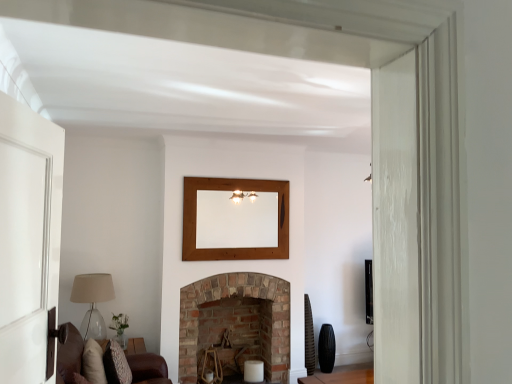
Question: Is translucent glass lampshade at left outside of brown leather couch at lower left?

Choices:
 (A) no
 (B) yes

Answer: (B)

Question: Can you confirm if translucent glass lampshade at left is positioned to the right of brown leather couch at lower left?

Choices:
 (A) no
 (B) yes

Answer: (A)

Question: From a real-world perspective, is translucent glass lampshade at left located higher than brown leather couch at lower left?

Choices:
 (A) yes
 (B) no

Answer: (A)

Question: Is translucent glass lampshade at left to the left of brown leather couch at lower left from the viewer's perspective?

Choices:
 (A) no
 (B) yes

Answer: (B)

Question: Is translucent glass lampshade at left wider than brown leather couch at lower left?

Choices:
 (A) no
 (B) yes

Answer: (A)

Question: In terms of width, does wooden mirror at upper center look wider or thinner when compared to brown leather couch at lower left?

Choices:
 (A) thin
 (B) wide

Answer: (A)

Question: From a real-world perspective, is wooden mirror at upper center positioned above or below brown leather couch at lower left?

Choices:
 (A) above
 (B) below

Answer: (A)

Question: Is point [x=251, y=215] closer or farther from the camera than point [x=134, y=375]?

Choices:
 (A) closer
 (B) farther

Answer: (B)

Question: Would you say wooden mirror at upper center is inside or outside brown leather couch at lower left?

Choices:
 (A) outside
 (B) inside

Answer: (A)

Question: Considering the positions of translucent glass lampshade at left and wooden mirror at upper center in the image, is translucent glass lampshade at left bigger or smaller than wooden mirror at upper center?

Choices:
 (A) small
 (B) big

Answer: (B)

Question: Looking at their shapes, would you say translucent glass lampshade at left is wider or thinner than wooden mirror at upper center?

Choices:
 (A) thin
 (B) wide

Answer: (B)

Question: Considering their positions, is translucent glass lampshade at left located in front of or behind wooden mirror at upper center?

Choices:
 (A) front
 (B) behind

Answer: (A)

Question: Is point (99, 291) closer or farther from the camera than point (253, 210)?

Choices:
 (A) farther
 (B) closer

Answer: (B)

Question: Considering the positions of brown leather couch at lower left and wooden mirror at upper center in the image, is brown leather couch at lower left taller or shorter than wooden mirror at upper center?

Choices:
 (A) tall
 (B) short

Answer: (B)

Question: Considering the positions of brown leather couch at lower left and wooden mirror at upper center in the image, is brown leather couch at lower left wider or thinner than wooden mirror at upper center?

Choices:
 (A) wide
 (B) thin

Answer: (A)